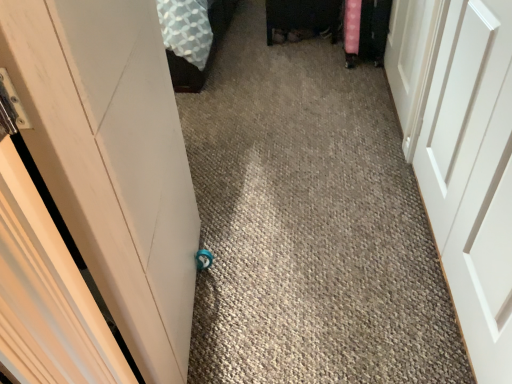
Question: Choose the correct answer: Is white matte door at center, which ranks as the 2th door in left-to-right order, inside white matte door at right, which is the 3th door from left to right, or outside it?

Choices:
 (A) inside
 (B) outside

Answer: (B)

Question: From a real-world perspective, is white matte door at center, which appears as the second door when viewed from the right, positioned above or below white matte door at right, which is counted as the 1th door, starting from the right?

Choices:
 (A) below
 (B) above

Answer: (B)

Question: Which is farther from the white matte door at center, which appears as the second door when viewed from the right?

Choices:
 (A) white matte door at right, which is counted as the 1th door, starting from the right
 (B) white matte door at left, arranged as the 3th door when viewed from the right

Answer: (B)

Question: Which object is the closest to the white matte door at left, arranged as the 3th door when viewed from the right?

Choices:
 (A) white matte door at center, which appears as the second door when viewed from the right
 (B) white matte door at right, which is the 3th door from left to right

Answer: (A)